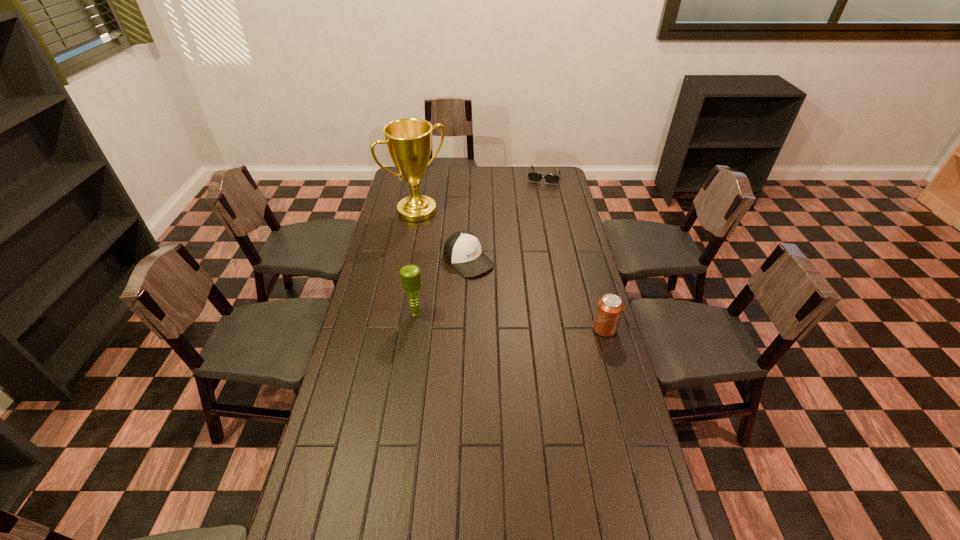
This screenshot has width=960, height=540. What are the coordinates of `vacant space located 0.090m on the front-facing side of the sunglasses` in the screenshot? It's located at (540, 194).

Identify the location of vacant space located 0.130m on the front-facing side of the sunglasses. (538, 198).

Where is `free spot located 0.050m on the front-facing side of the sunglasses`? free spot located 0.050m on the front-facing side of the sunglasses is located at coordinates (540, 190).

Identify the location of free spot located 0.140m on the front panel of the third object from right to left. (504, 295).

Image resolution: width=960 pixels, height=540 pixels. Identify the location of vacant space located 0.200m on the front panel of the third object from right to left. (515, 304).

Identify the location of vacant area located 0.360m on the front panel of the third object from right to left. (542, 330).

The image size is (960, 540). I want to click on vacant area situated 0.080m by the handles of the tallest object, so click(442, 230).

The image size is (960, 540). Find the location of `vacant space located by the handles of the tallest object`. vacant space located by the handles of the tallest object is located at coordinates coord(444,232).

Find the location of a particular element. Image resolution: width=960 pixels, height=540 pixels. blank space located 0.160m by the handles of the tallest object is located at coordinates [x=451, y=238].

Where is `object that is at the far edge`? object that is at the far edge is located at coordinates (532, 176).